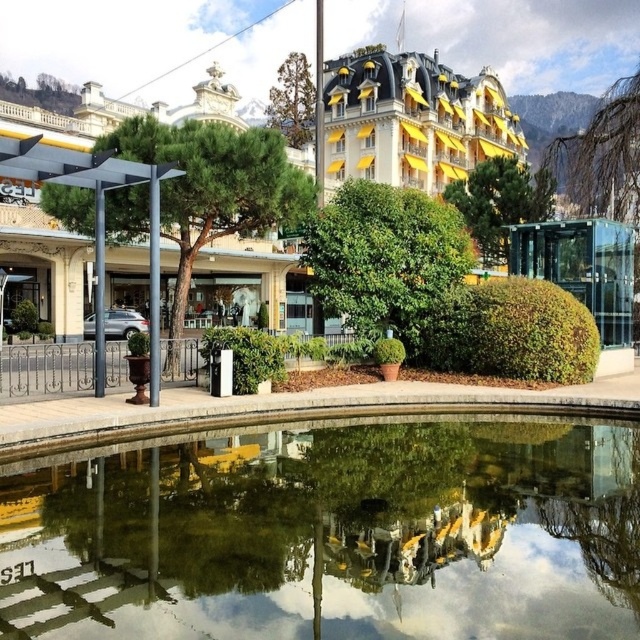
You are standing at the center of the pond and looking towards the yellow awnings. There is a point labeled as point [385,257] on a green leafy bush at center. Is this point closer to the water or the building?

The point [385,257] is on the green leafy bush at center, so it is closer to the water than the building.

You are a landscape architect designing a walking path between the green leafy tree at left and the green leafy bush at center. What is the minimum width the path should be to ensure it accommodates a standard wheelchair, which requires at least 1.2 meters of width?

The path between the green leafy tree at left and the green leafy bush at center is 6.52 meters apart. However, the question asks for the minimum width of the path, not the distance between them. Since the required width for a wheelchair is 1.2 meters, the path should be at least 1.2 meters wide to accommodate it properly.

Consider the image. You are standing on the wooden bridge that crosses over the pond. Looking towards the buildings, you see a green leafy tree at left and a green leafy bush at center. Which of these plants is closer to your left side?

The green leafy tree at left is closer to your left side because it is positioned to the left of the green leafy bush at center.